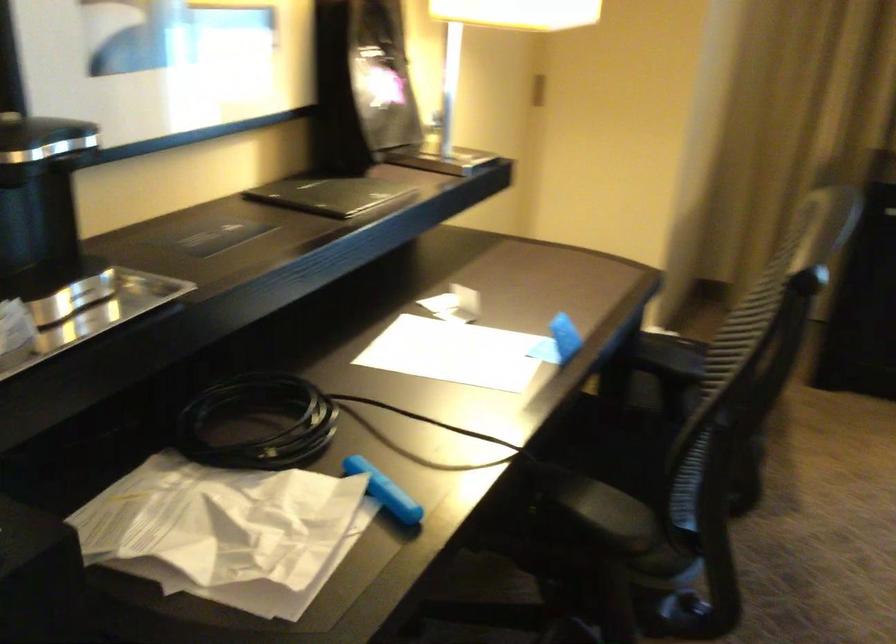
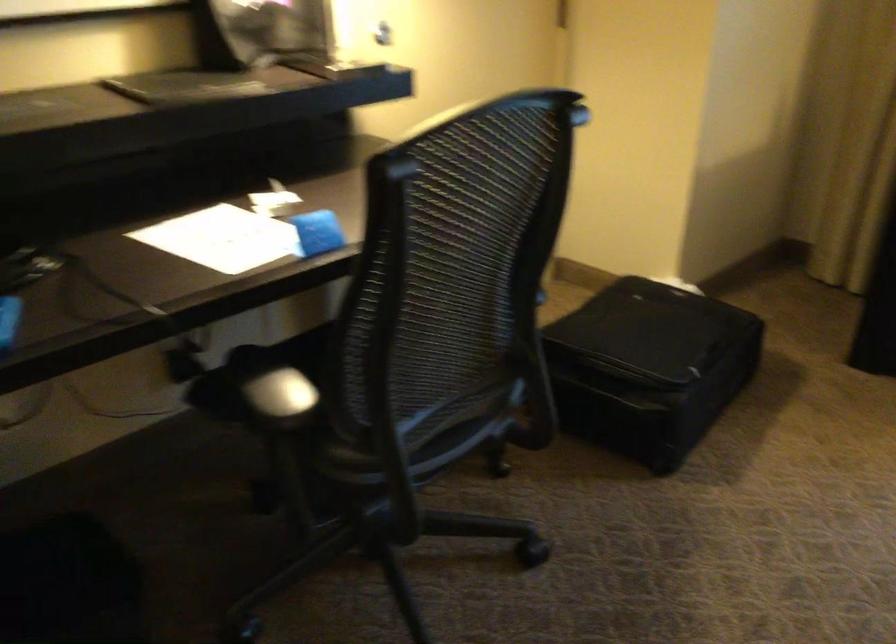
Find the pixel in the second image that matches [570,486] in the first image.

(259, 371)